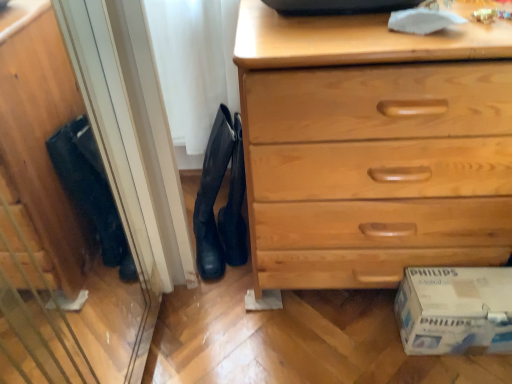
Question: Is light wood chest of drawers at lower right inside the boundaries of white cardboard box at lower right, or outside?

Choices:
 (A) inside
 (B) outside

Answer: (B)

Question: Is light wood chest of drawers at lower right wider or thinner than white cardboard box at lower right?

Choices:
 (A) thin
 (B) wide

Answer: (B)

Question: Estimate the real-world distances between objects in this image. Which object is farther from the black suede boot at center?

Choices:
 (A) black leather boots at center
 (B) white cardboard box at lower right
 (C) light wood chest of drawers at lower right

Answer: (B)

Question: Estimate the real-world distances between objects in this image. Which object is farther from the light wood chest of drawers at lower right?

Choices:
 (A) black leather boots at center
 (B) white cardboard box at lower right
 (C) black suede boot at center

Answer: (C)